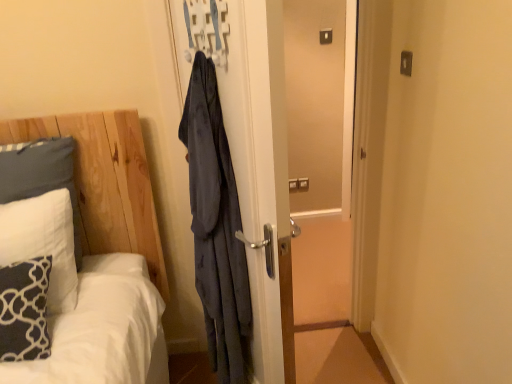
Question: Considering the relative sizes of white soft pillow at left, positioned as the 1th pillow in back-to-front order, and dark blue textured pillow at lower left, which is the 1th pillow in front-to-back order, in the image provided, is white soft pillow at left, positioned as the 1th pillow in back-to-front order, thinner than dark blue textured pillow at lower left, which is the 1th pillow in front-to-back order,?

Choices:
 (A) yes
 (B) no

Answer: (A)

Question: Are white soft pillow at left, positioned as the 1th pillow in back-to-front order, and dark blue textured pillow at lower left, which is the 1th pillow in front-to-back order, far apart?

Choices:
 (A) yes
 (B) no

Answer: (B)

Question: Does white soft pillow at left, positioned as the 1th pillow in back-to-front order, lie behind dark blue textured pillow at lower left, which is the 1th pillow in front-to-back order?

Choices:
 (A) no
 (B) yes

Answer: (B)

Question: Can you confirm if white soft pillow at left, positioned as the 1th pillow in back-to-front order, is positioned to the left of dark blue textured pillow at lower left, which ranks as the 3th pillow in back-to-front order?

Choices:
 (A) yes
 (B) no

Answer: (A)

Question: Is white soft pillow at left, positioned as the 1th pillow in back-to-front order, facing towards dark blue textured pillow at lower left, which ranks as the 3th pillow in back-to-front order?

Choices:
 (A) no
 (B) yes

Answer: (B)

Question: Considering the positions of point (25, 157) and point (320, 33), is point (25, 157) closer or farther from the camera than point (320, 33)?

Choices:
 (A) farther
 (B) closer

Answer: (B)

Question: From a real-world perspective, is white soft pillow at left, positioned as the 1th pillow in back-to-front order, physically located above or below matte plastic light switch at upper center?

Choices:
 (A) below
 (B) above

Answer: (A)

Question: From the image's perspective, is white soft pillow at left, positioned as the 1th pillow in back-to-front order, located above or below matte plastic light switch at upper center?

Choices:
 (A) below
 (B) above

Answer: (A)

Question: In terms of width, does white soft pillow at left, positioned as the 1th pillow in back-to-front order, look wider or thinner when compared to matte plastic light switch at upper center?

Choices:
 (A) thin
 (B) wide

Answer: (B)

Question: From a real-world perspective, is white soft pillow at left, positioned as the second pillow in front-to-back order, physically located above or below dark blue textured pillow at lower left, which is the 1th pillow in front-to-back order?

Choices:
 (A) below
 (B) above

Answer: (B)

Question: Is white soft pillow at left, positioned as the second pillow in front-to-back order, in front of or behind dark blue textured pillow at lower left, which is the 1th pillow in front-to-back order, in the image?

Choices:
 (A) front
 (B) behind

Answer: (B)

Question: Would you say white soft pillow at left, which is the 2th pillow in back-to-front order, is to the left or to the right of dark blue textured pillow at lower left, which is the 1th pillow in front-to-back order, in the picture?

Choices:
 (A) right
 (B) left

Answer: (B)

Question: Is point (8, 241) positioned closer to the camera than point (27, 269)?

Choices:
 (A) farther
 (B) closer

Answer: (A)

Question: In terms of width, does matte plastic light switch at upper center look wider or thinner when compared to white soft pillow at left, which is the third pillow from front to back?

Choices:
 (A) thin
 (B) wide

Answer: (A)

Question: In terms of height, does matte plastic light switch at upper center look taller or shorter compared to white soft pillow at left, which is the third pillow from front to back?

Choices:
 (A) short
 (B) tall

Answer: (A)